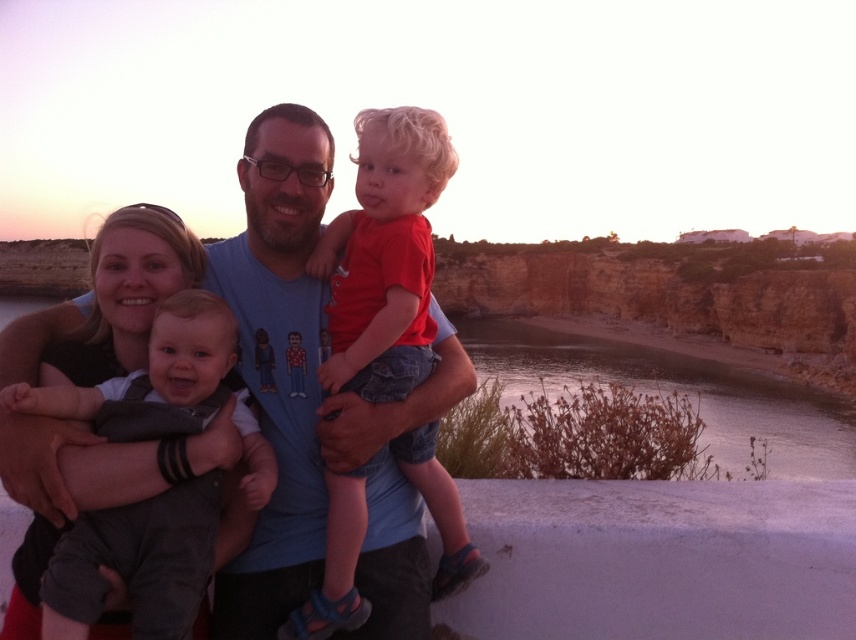
Question: Can you confirm if blue t-shirt at center is smaller than red cotton shirt at center?

Choices:
 (A) yes
 (B) no

Answer: (B)

Question: Can you confirm if red cotton shirt at center is positioned to the right of gray cotton onesie at center left?

Choices:
 (A) yes
 (B) no

Answer: (A)

Question: Which object is farther from the camera taking this photo?

Choices:
 (A) red cotton shirt at center
 (B) blue t-shirt at center
 (C) gray cotton onesie at center left

Answer: (A)

Question: Which point is farther from the camera taking this photo?

Choices:
 (A) (324, 275)
 (B) (270, 536)

Answer: (A)

Question: Estimate the real-world distances between objects in this image. Which object is closer to the gray cotton onesie at center left?

Choices:
 (A) blue t-shirt at center
 (B) red cotton shirt at center

Answer: (A)

Question: Is red cotton shirt at center further to camera compared to gray cotton onesie at center left?

Choices:
 (A) yes
 (B) no

Answer: (A)